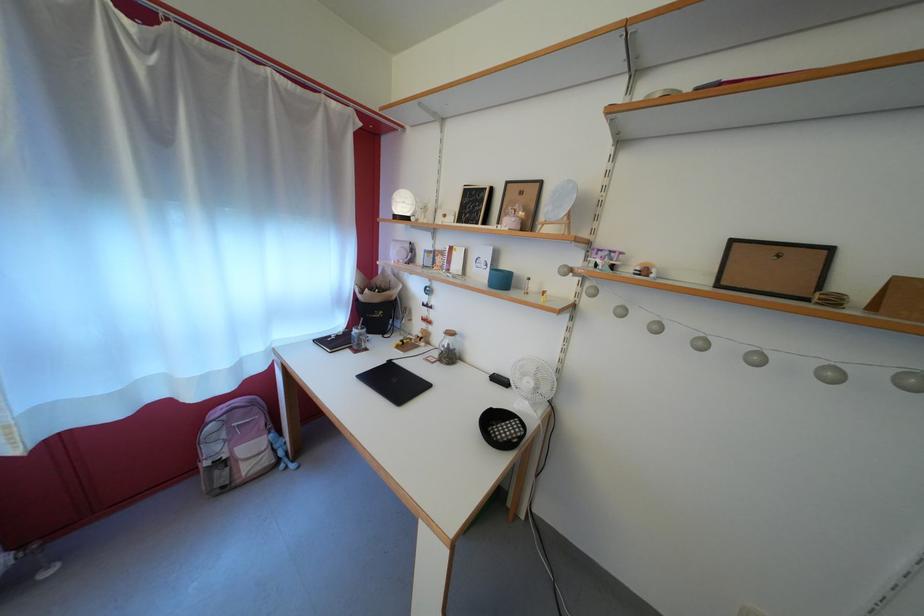
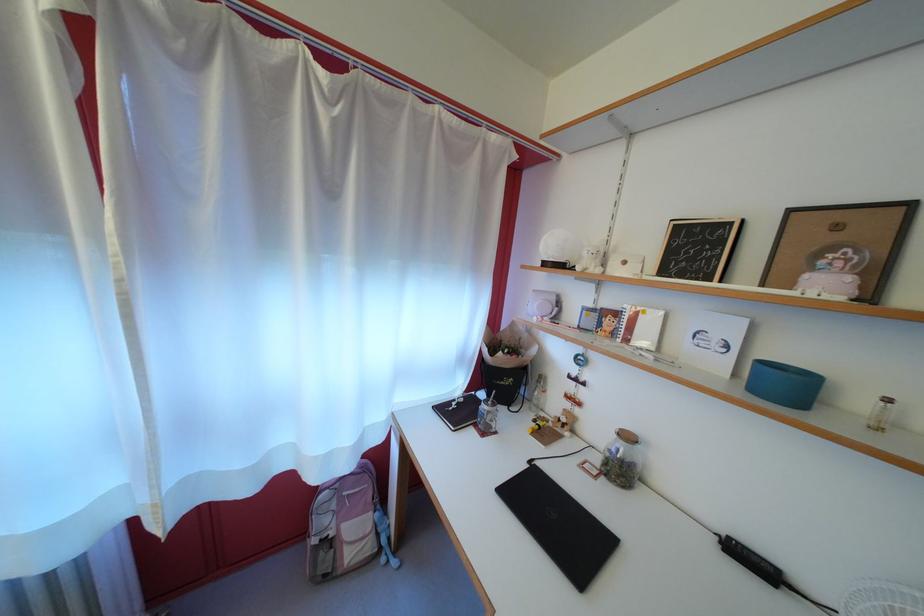
Find the pixel in the second image that matches (x=359, y=354) in the first image.

(483, 431)